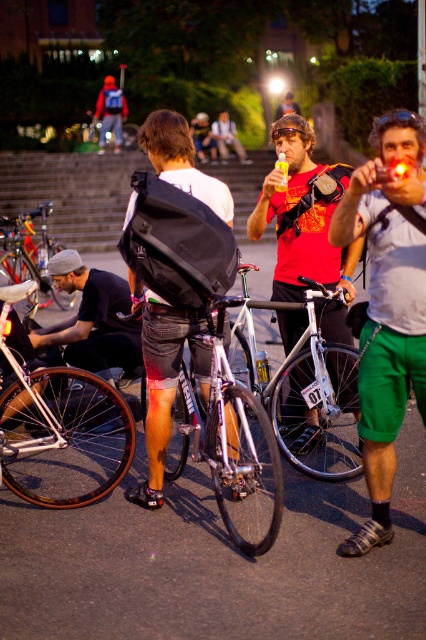
Is matte black bicycle at center positioned at the back of shiny silver bicycle at center?

No, it is in front of shiny silver bicycle at center.

Does matte black bicycle at center have a greater width compared to shiny silver bicycle at center?

Yes, matte black bicycle at center is wider than shiny silver bicycle at center.

Identify the location of matte black bicycle at center. (94, 321).

Describe the element at coordinates (388, 304) in the screenshot. I see `matte black backpack at center` at that location.

Which is more to the right, matte black backpack at center or denim shorts at center?

matte black backpack at center

Image resolution: width=426 pixels, height=640 pixels. Find the location of `matte black backpack at center`. matte black backpack at center is located at coordinates pyautogui.click(x=388, y=304).

Which is more to the left, shiny metallic bicycle at center or silver metallic bicycle at center?

shiny metallic bicycle at center is more to the left.

Who is more forward, [236,506] or [336,465]?

Point [236,506]

Does point (215, 428) lie in front of point (279, 424)?

Yes, point (215, 428) is in front of point (279, 424).

I want to click on shiny metallic bicycle at center, so click(x=232, y=445).